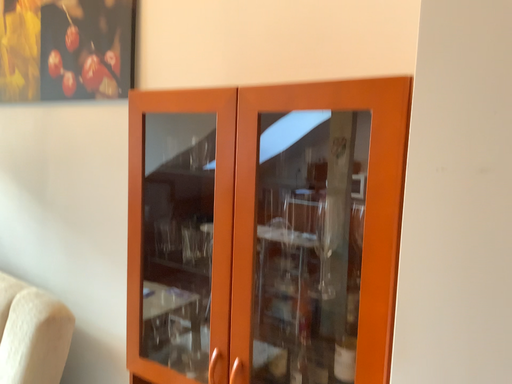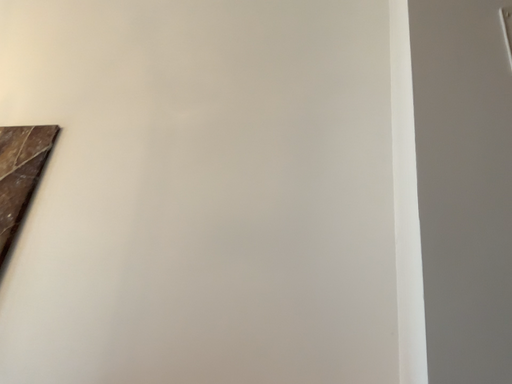
Question: How did the camera likely rotate when shooting the video?

Choices:
 (A) rotated upward
 (B) rotated downward

Answer: (A)